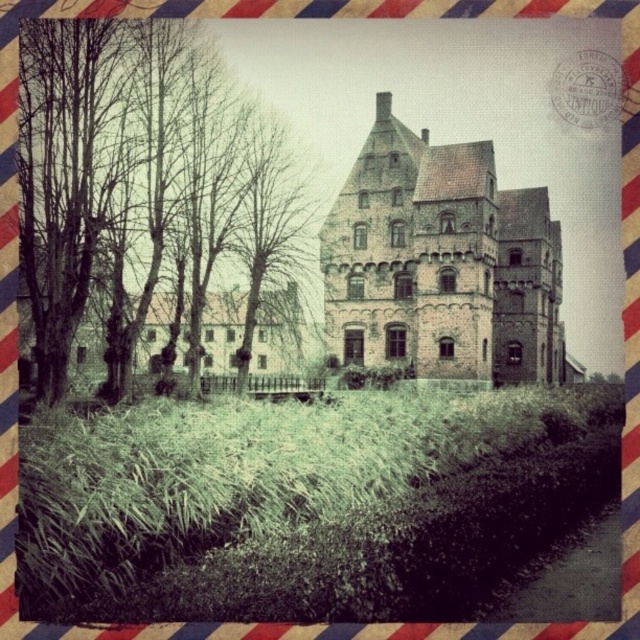
You are a visitor standing in the garden of the brown stone castle at center. Looking towards the bare branches at left, where are they positioned relative to the castle?

The bare branches at left are positioned above the brown stone castle at center.